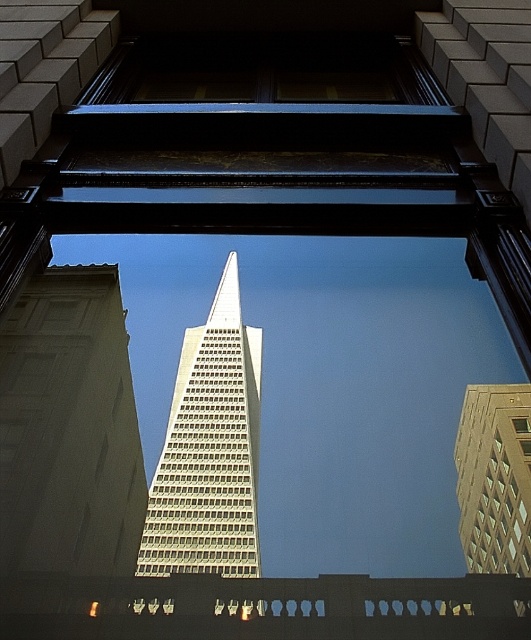
You are standing on the street below and looking up at the white glass skyscraper at center and the gold glass building at center. Which building appears closer to you?

The white glass skyscraper at center appears closer to you because it is positioned further to the viewer than the gold glass building at center.

You are standing in a park across from the two buildings. You want to take a photo of the white glass skyscraper at center without the gold glass building at center blocking it. How should you adjust your position?

The white glass skyscraper at center is positioned under the gold glass building at center, so to avoid the gold glass building at center blocking it, you should move to a lower position or angle your camera downward to capture the white glass skyscraper at center below the gold glass building at center.

You are standing in front of the ornate window frame and want to take a photo of the white glass skyscraper at center. Given that the camera can only focus on objects within a 0.5 unit radius from the center point of the image, which is at coordinates 0.5, 0.5, will the skyscraper be in focus?

The white glass skyscraper at center is located at point (209, 449). The distance from the center of the image at (265, 320) can be calculated using the Euclidean distance formula. The difference in the x coordinates is 0.703 minus 0.5 equals 0.203, and the difference in the y coordinates is 0.395 minus 0.5 equals negative 0.105. Squaring both differences gives 0.041 and 0.011, respectively. Adding them together is 0.052, and the square root of that is approximately 0.228 units. Since 0.228 is less than 0.5